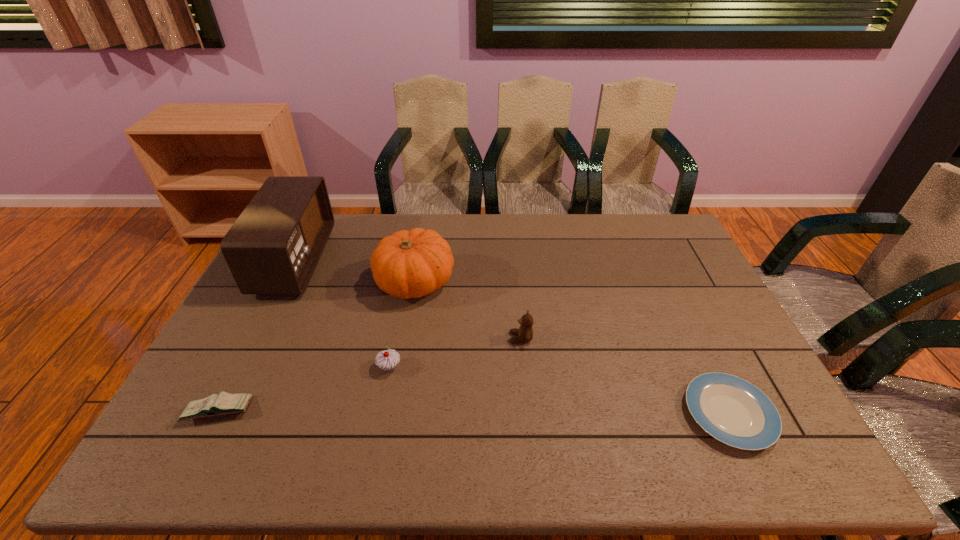
The height and width of the screenshot is (540, 960). Find the location of `vacant space that's between the third nearest object and the shortest object`. vacant space that's between the third nearest object and the shortest object is located at coordinates (559, 391).

Identify the location of free space between the tallest object and the shortest object. (512, 338).

The width and height of the screenshot is (960, 540). Identify the location of free space between the diary and the fifth shortest object. (317, 347).

You are a GUI agent. You are given a task and a screenshot of the screen. Output one action in this format:
    pyautogui.click(x=<x>, y=<y>)
    Task: Click on the vacant area between the cupcake and the plate
    
    Given the screenshot: What is the action you would take?
    pyautogui.click(x=559, y=391)

Image resolution: width=960 pixels, height=540 pixels. I want to click on empty space that is in between the shortest object and the cupcake, so click(559, 391).

Find the location of `vacant space that's between the cupcake and the diary`. vacant space that's between the cupcake and the diary is located at coordinates (304, 389).

The height and width of the screenshot is (540, 960). Find the location of `free space between the tallest object and the second tallest object`. free space between the tallest object and the second tallest object is located at coordinates (355, 272).

Find the location of `the fifth closest object to the cupcake`. the fifth closest object to the cupcake is located at coordinates (732, 410).

Select which object is the second closest to the third nearest object. Please provide its 2D coordinates. Your answer should be formatted as a tuple, i.e. [(x, y)], where the tuple contains the x and y coordinates of a point satisfying the conditions above.

[(225, 403)]

The image size is (960, 540). Find the location of `vacant region that satisfies the following two spatial constraints: 1. on the front-facing side of the tallest object; 2. on the right side of the shortest object`. vacant region that satisfies the following two spatial constraints: 1. on the front-facing side of the tallest object; 2. on the right side of the shortest object is located at coordinates (218, 414).